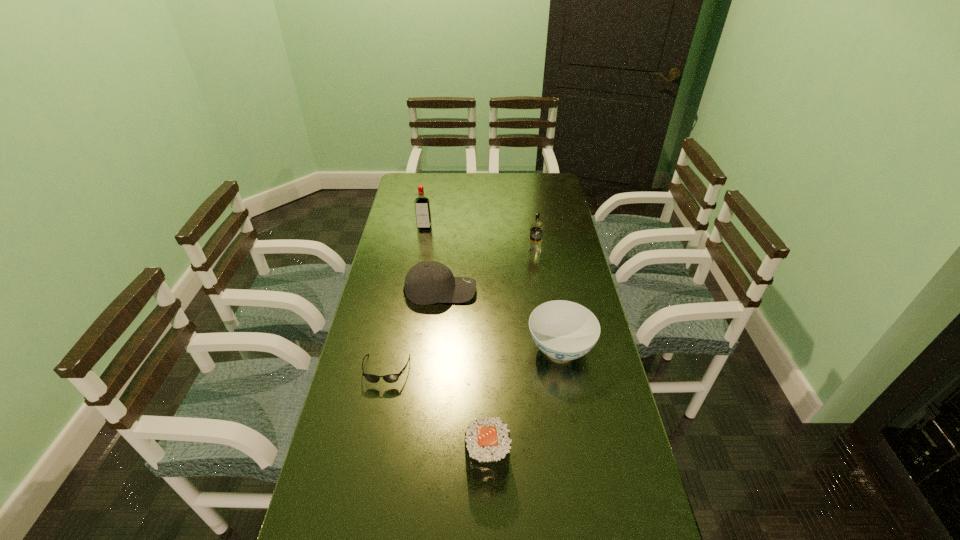
Locate an element on the screen. vacant space located 0.080m on the front brim of the fourth nearest object is located at coordinates (498, 290).

Find the location of a particular element. free space located on the back of the sushi is located at coordinates (487, 399).

What are the coordinates of `vacant area situated on the back of the chinaware` in the screenshot? It's located at (551, 299).

Where is `free space located on the front-facing side of the shortest object`? The width and height of the screenshot is (960, 540). free space located on the front-facing side of the shortest object is located at coordinates (367, 469).

Where is `vodka positioned at the left edge`? vodka positioned at the left edge is located at coordinates coord(422,204).

The height and width of the screenshot is (540, 960). In order to click on baseball cap that is positioned at the left edge in this screenshot , I will do `click(427, 282)`.

The height and width of the screenshot is (540, 960). Find the location of `sunglasses that is at the left edge`. sunglasses that is at the left edge is located at coordinates (391, 378).

The width and height of the screenshot is (960, 540). In order to click on vodka that is at the right edge in this screenshot , I will do `click(536, 227)`.

At what (x,y) coordinates should I click in order to perform the action: click on chinaware located at the right edge. Please return your answer as a coordinate pair (x, y). This screenshot has height=540, width=960. Looking at the image, I should click on (564, 330).

The width and height of the screenshot is (960, 540). In the image, there is a desktop. In order to click on vacant space at the far edge in this screenshot , I will do click(x=448, y=190).